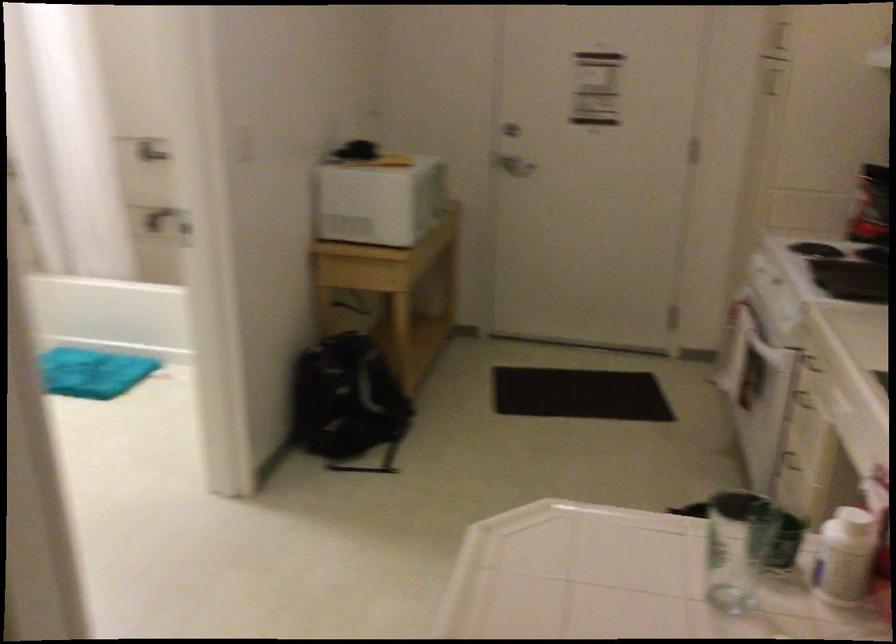
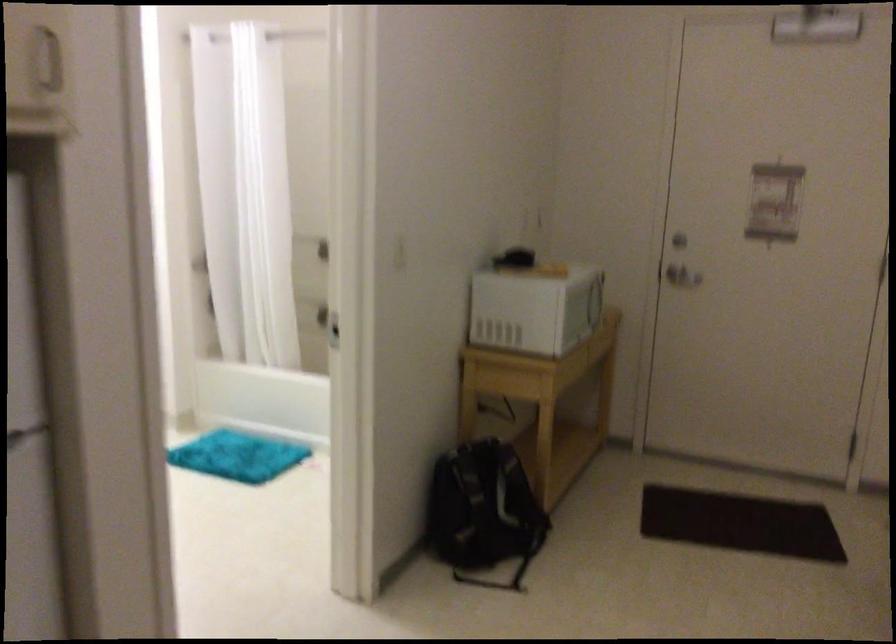
Where in the second image is the point corresponding to (x=349, y=402) from the first image?

(483, 512)